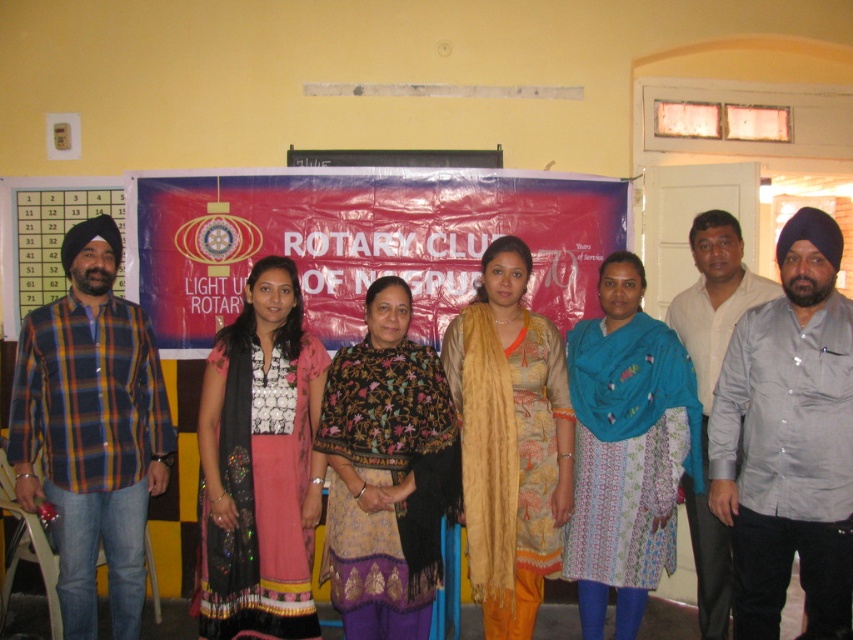
Does point (306, 548) lie behind point (358, 428)?

That is True.

Is matte black dress at center bigger than printed fabric shawl at center?

Yes.

Which is behind, point (225, 400) or point (457, 470)?

The point (457, 470) is more distant.

At what (x,y) coordinates should I click in order to perform the action: click on matte black dress at center. Please return your answer as a coordinate pair (x, y). The image size is (853, 640). Looking at the image, I should click on (260, 465).

Which of these two, plaid flannel shirt at left or beige textured scarf at center, stands taller?

With more height is plaid flannel shirt at left.

Can you confirm if plaid flannel shirt at left is positioned to the right of beige textured scarf at center?

No, plaid flannel shirt at left is not to the right of beige textured scarf at center.

This screenshot has width=853, height=640. What do you see at coordinates (91, 429) in the screenshot? I see `plaid flannel shirt at left` at bounding box center [91, 429].

At what (x,y) coordinates should I click in order to perform the action: click on plaid flannel shirt at left. Please return your answer as a coordinate pair (x, y). This screenshot has width=853, height=640. Looking at the image, I should click on (91, 429).

Which of these two, matte black dress at center or beige textured scarf at center, stands shorter?

Standing shorter between the two is matte black dress at center.

Describe the element at coordinates (260, 465) in the screenshot. I see `matte black dress at center` at that location.

Describe the element at coordinates (260, 465) in the screenshot. The image size is (853, 640). I see `matte black dress at center` at that location.

Locate an element on the screen. Image resolution: width=853 pixels, height=640 pixels. matte black dress at center is located at coordinates (260, 465).